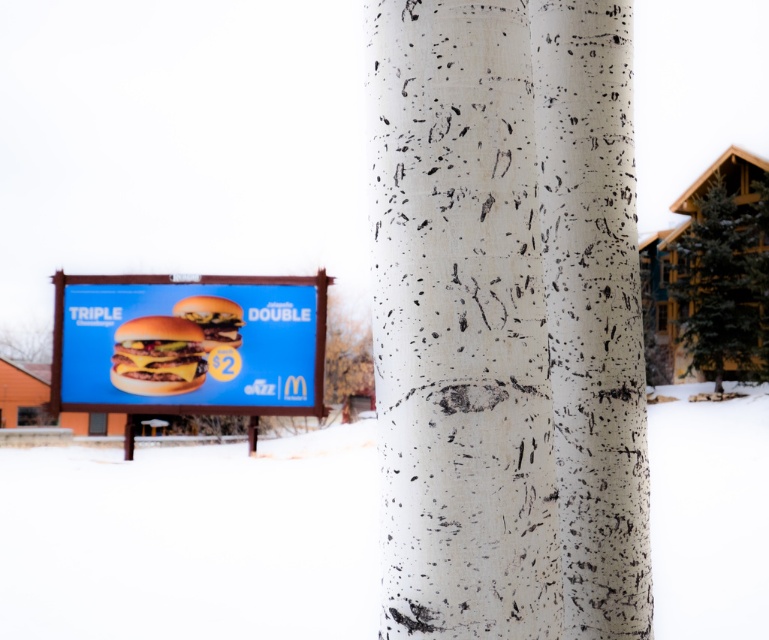
You are standing in a forest and see the blue cardboard billboard at center. You want to place a 25 meter long ladder between you and the billboard. Will the ladder be long enough to reach the billboard?

The distance between you and the blue cardboard billboard at center is 30.01 meters, so the 25 meter long ladder will not be long enough to reach the billboard.